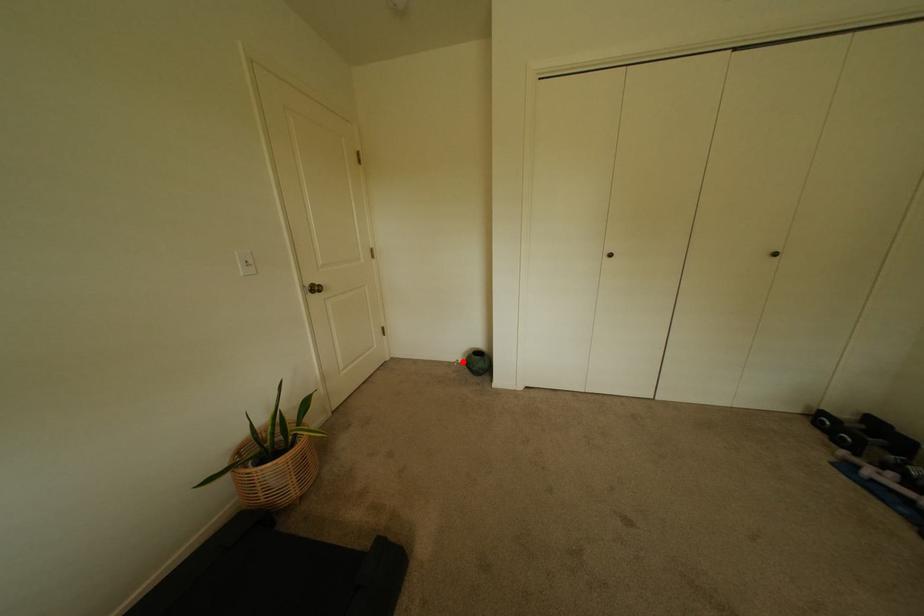
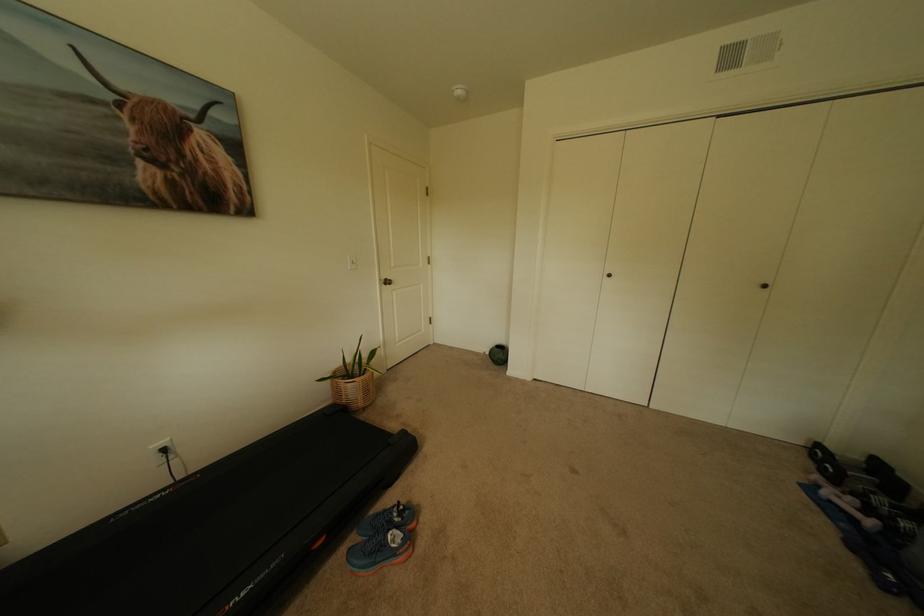
In the second image, find the point that corresponds to the highlighted location in the first image.

(491, 353)